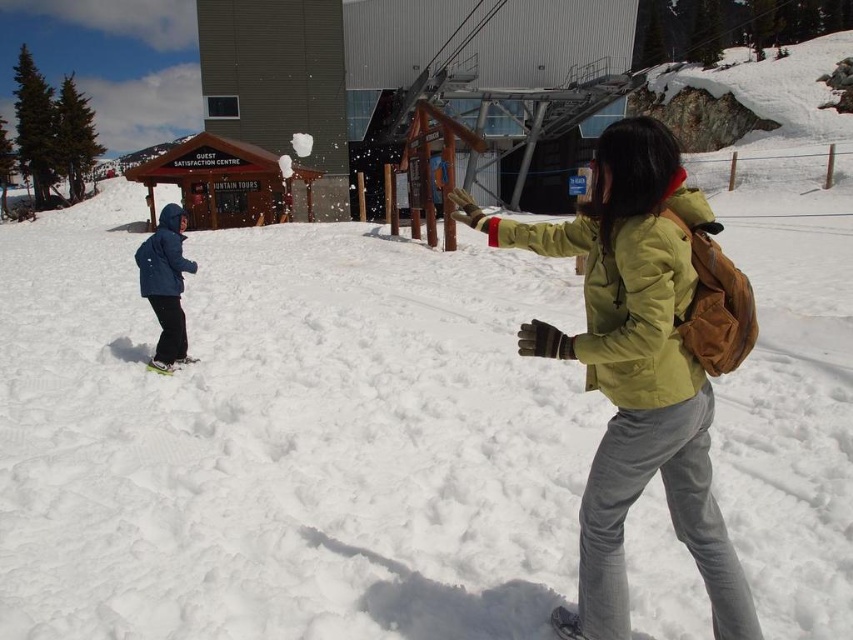
Question: Can you confirm if green fuzzy jacket at center is smaller than dark blue fabric jacket at left?

Choices:
 (A) yes
 (B) no

Answer: (A)

Question: From the image, what is the correct spatial relationship of matte green jacket at center in relation to green fuzzy jacket at center?

Choices:
 (A) below
 (B) above

Answer: (A)

Question: Which object appears farthest from the camera in this image?

Choices:
 (A) green plastic snowboard at left
 (B) white snow at center

Answer: (A)

Question: Which object is the farthest from the green fuzzy jacket at center?

Choices:
 (A) matte green jacket at center
 (B) white snow at center

Answer: (B)

Question: Which object is positioned farthest from the green plastic snowboard at left?

Choices:
 (A) matte green jacket at center
 (B) white snow at center

Answer: (A)

Question: From the image, what is the correct spatial relationship of white snow at center in relation to matte green jacket at center?

Choices:
 (A) below
 (B) above

Answer: (B)